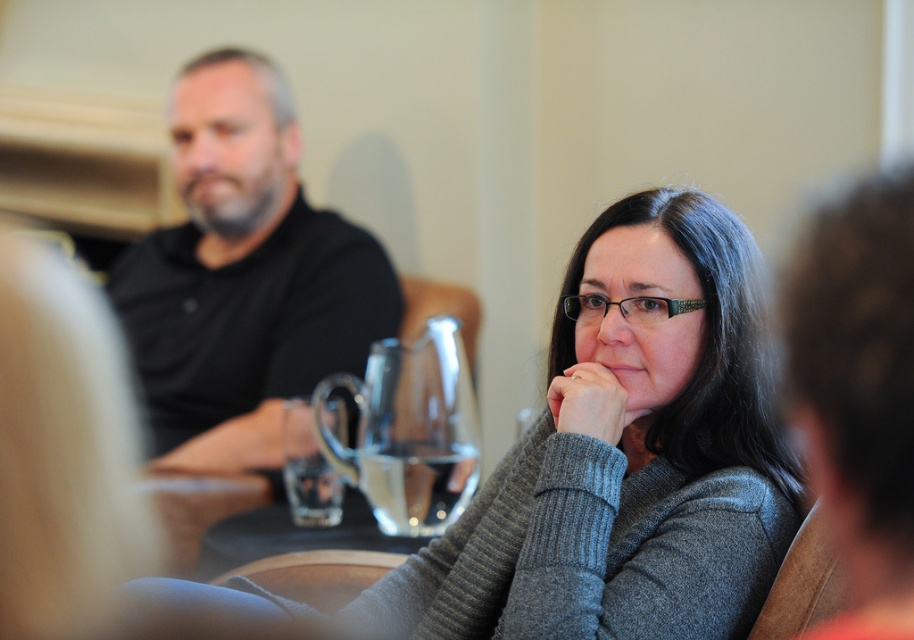
Question: Among these points, which one is farthest from the camera?

Choices:
 (A) (335, 380)
 (B) (687, 428)

Answer: (A)

Question: Is the position of black matte shirt at upper left less distant than that of transparent glass pitcher at center?

Choices:
 (A) no
 (B) yes

Answer: (A)

Question: Which point appears farthest from the camera in this image?

Choices:
 (A) (747, 412)
 (B) (448, 476)

Answer: (B)

Question: Which object is the closest to the black matte shirt at upper left?

Choices:
 (A) gray knitted sweater at center
 (B) transparent glass pitcher at center

Answer: (B)

Question: Where is gray knitted sweater at center located in relation to transparent glass pitcher at center in the image?

Choices:
 (A) right
 (B) left

Answer: (A)

Question: Is gray knitted sweater at center wider than transparent glass pitcher at center?

Choices:
 (A) yes
 (B) no

Answer: (A)